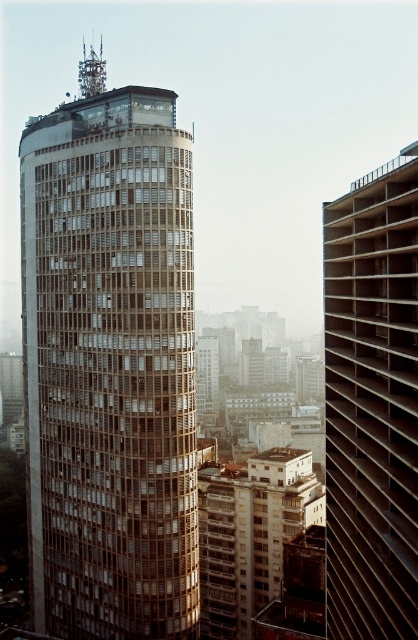
Is matte brown tower at center thinner than brown textured building at right?

In fact, matte brown tower at center might be wider than brown textured building at right.

Does point (99, 276) come closer to viewer compared to point (413, 476)?

No, it is not.

Image resolution: width=418 pixels, height=640 pixels. What do you see at coordinates (109, 364) in the screenshot?
I see `matte brown tower at center` at bounding box center [109, 364].

Locate an element on the screen. The height and width of the screenshot is (640, 418). matte brown tower at center is located at coordinates (109, 364).